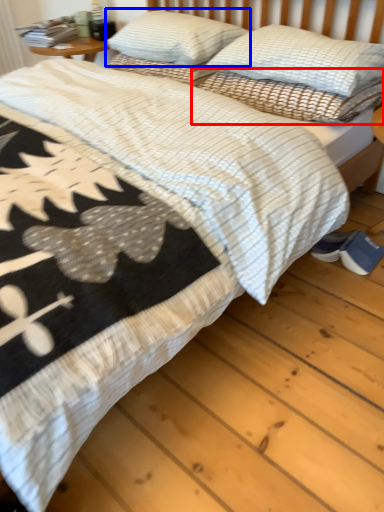
Question: Which object is closer to the camera taking this photo, pillow (highlighted by a red box) or pillow (highlighted by a blue box)?

Choices:
 (A) pillow
 (B) pillow

Answer: (A)